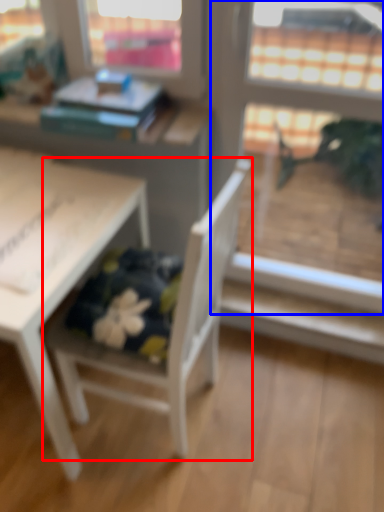
Question: Which point is closer to the camera, chair (highlighted by a red box) or screen door (highlighted by a blue box)?

Choices:
 (A) chair
 (B) screen door

Answer: (A)